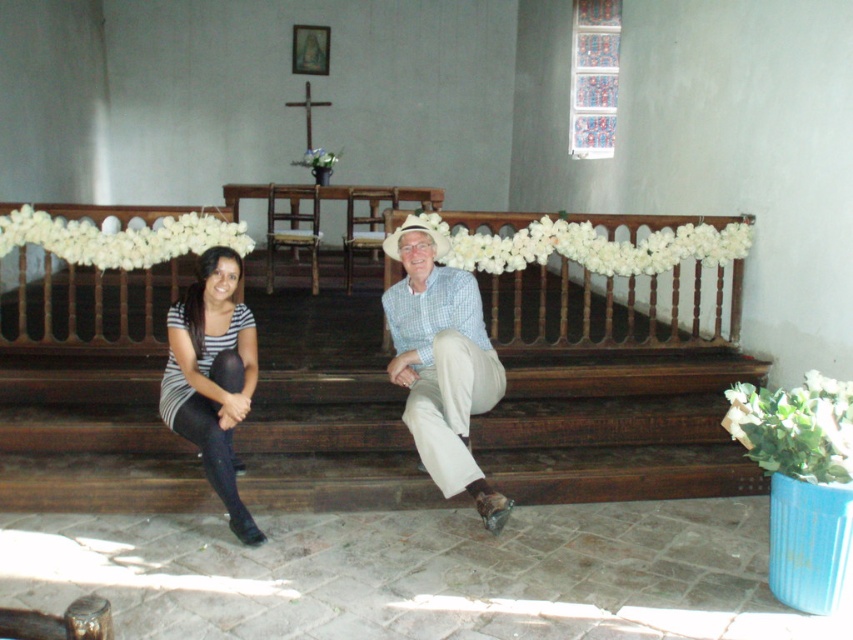
You are standing in front of the bench and want to place a small gift on the closest object to you between the striped fabric shirt at center and the white floral garland at center. Which object should you place it on?

The striped fabric shirt at center is closer to the viewer than the white floral garland at center, so you should place the small gift on the striped fabric shirt at center.

In the scene shown: You are planning to take a photo of the two people sitting on the bench. To ensure both are in frame, you need to position yourself so that the striped fabric dress at left is not blocked by the light blue checkered shirt at center. Where should you stand relative to the bench?

You should stand to the left side of the bench so that the striped fabric dress at left is visible and not blocked by the light blue checkered shirt at center, which is positioned to its right.